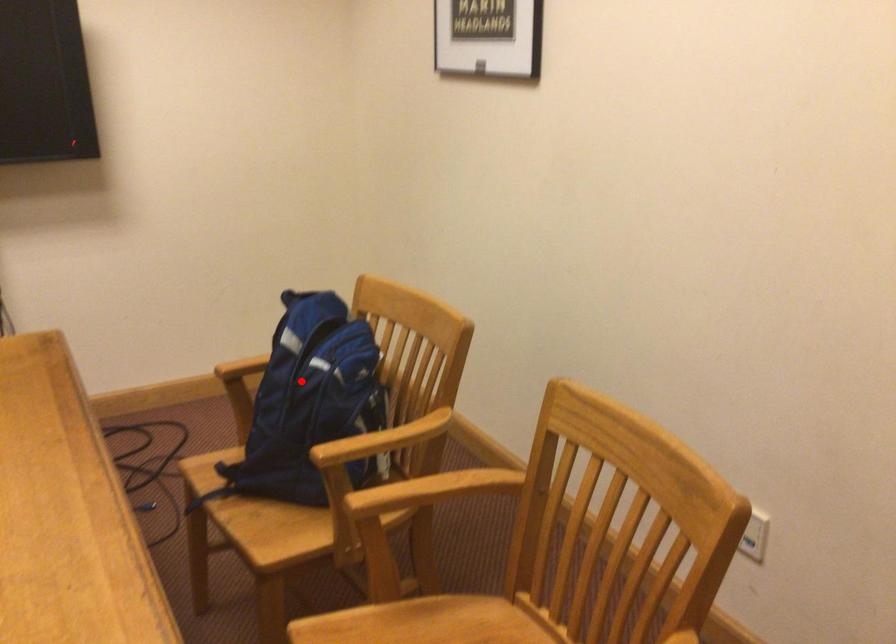
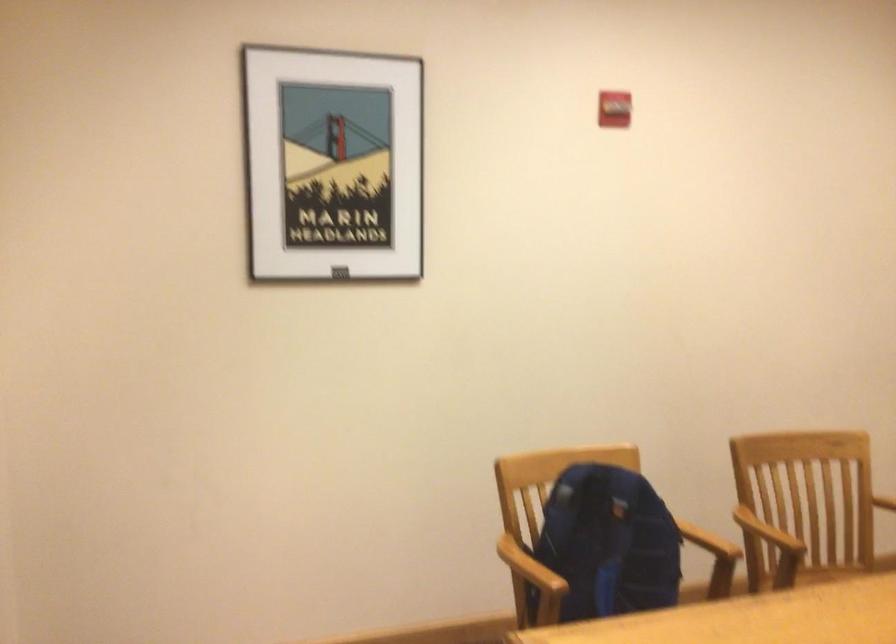
Question: A red point is marked in image1. In image2, is the corresponding 3D point closer to the camera or farther? Reply with the corresponding letter.

Choices:
 (A) The corresponding 3D point is closer.
 (B) The corresponding 3D point is farther.

Answer: (B)